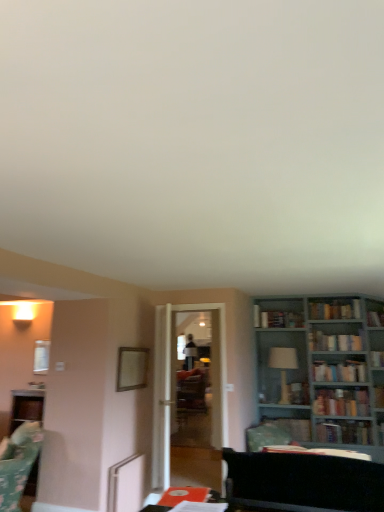
Question: Is white glossy lampshade at center-right inside hardcover books at right, the 7th book when ordered from front to back?

Choices:
 (A) yes
 (B) no

Answer: (B)

Question: Can you confirm if hardcover books at right, the 2th book from the back, is thinner than white glossy lampshade at center-right?

Choices:
 (A) no
 (B) yes

Answer: (B)

Question: Does hardcover books at right, the 7th book when ordered from front to back, lie in front of white glossy lampshade at center-right?

Choices:
 (A) yes
 (B) no

Answer: (B)

Question: From a real-world perspective, is hardcover books at right, the 7th book when ordered from front to back, positioned under white glossy lampshade at center-right based on gravity?

Choices:
 (A) yes
 (B) no

Answer: (B)

Question: Does hardcover books at right, the 2th book from the back, have a lesser height compared to white glossy lampshade at center-right?

Choices:
 (A) yes
 (B) no

Answer: (A)

Question: Is the position of hardcover books at right, the 2th book from the back, more distant than that of white glossy lampshade at center-right?

Choices:
 (A) no
 (B) yes

Answer: (B)

Question: Is hardcover book at right, which is counted as the fifth book, starting from the back, completely or partially outside of hardcover book at upper center, which ranks as the 5th book in front-to-back order?

Choices:
 (A) no
 (B) yes

Answer: (B)

Question: Considering the relative positions of hardcover book at right, which ranks as the 4th book in front-to-back order, and hardcover book at upper center, which ranks as the 5th book in front-to-back order, in the image provided, is hardcover book at right, which ranks as the 4th book in front-to-back order, to the right of hardcover book at upper center, which ranks as the 5th book in front-to-back order, from the viewer's perspective?

Choices:
 (A) no
 (B) yes

Answer: (B)

Question: Does hardcover book at right, which ranks as the 4th book in front-to-back order, have a smaller size compared to hardcover book at upper center, which ranks as the 5th book in front-to-back order?

Choices:
 (A) yes
 (B) no

Answer: (A)

Question: Is the position of hardcover book at right, which is counted as the fifth book, starting from the back, more distant than that of hardcover book at upper center, which ranks as the 5th book in front-to-back order?

Choices:
 (A) yes
 (B) no

Answer: (B)

Question: From the image's perspective, is hardcover book at right, which is counted as the fifth book, starting from the back, located beneath hardcover book at upper center, which ranks as the 5th book in front-to-back order?

Choices:
 (A) yes
 (B) no

Answer: (A)

Question: Can hardcover book at upper center, acting as the 4th book starting from the back, be found inside hardcover book at right, which is counted as the fifth book, starting from the back?

Choices:
 (A) yes
 (B) no

Answer: (B)

Question: From the image's perspective, is hardcover book at upper center, which ranks as the 5th book in front-to-back order, beneath transparent glass door at center?

Choices:
 (A) no
 (B) yes

Answer: (A)